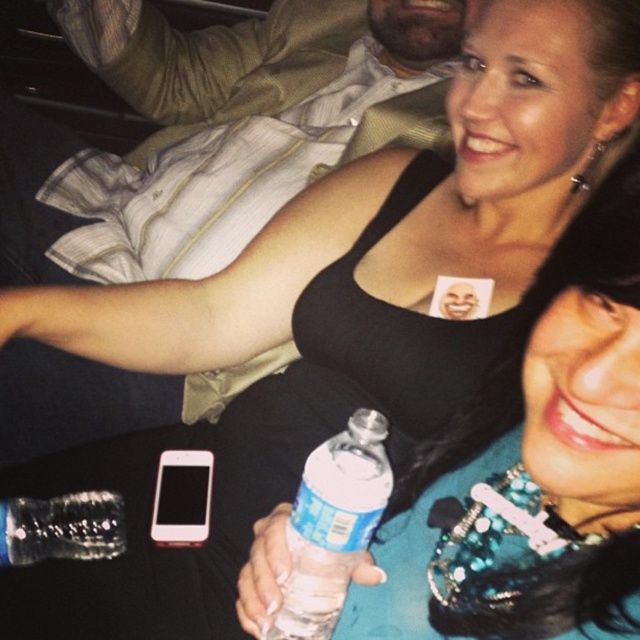
Question: Which point is closer to the camera taking this photo?

Choices:
 (A) (36, 557)
 (B) (314, 508)

Answer: (B)

Question: Which of the following is the farthest from the observer?

Choices:
 (A) clear plastic bottle at lower center
 (B) clear plastic bottle at center

Answer: (A)

Question: Among these points, which one is farthest from the camera?

Choices:
 (A) (305, 547)
 (B) (13, 563)

Answer: (B)

Question: Does clear plastic bottle at center have a larger size compared to clear plastic bottle at lower center?

Choices:
 (A) yes
 (B) no

Answer: (A)

Question: Does clear plastic bottle at center have a smaller size compared to clear plastic bottle at lower center?

Choices:
 (A) yes
 (B) no

Answer: (B)

Question: Does clear plastic bottle at center have a larger size compared to clear plastic bottle at lower center?

Choices:
 (A) yes
 (B) no

Answer: (A)